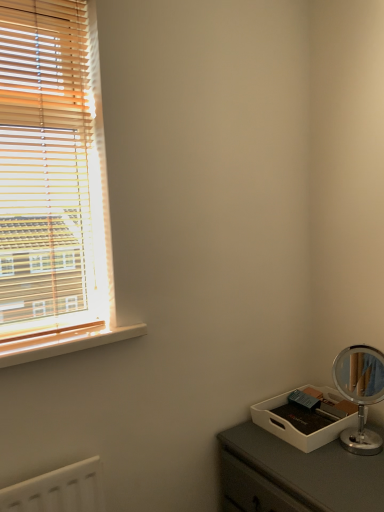
Question: From a real-world perspective, is wooden blinds at left physically below wooden at left?

Choices:
 (A) no
 (B) yes

Answer: (A)

Question: Considering the relative sizes of wooden blinds at left and wooden at left in the image provided, is wooden blinds at left smaller than wooden at left?

Choices:
 (A) yes
 (B) no

Answer: (B)

Question: Considering the relative positions of wooden blinds at left and wooden at left in the image provided, is wooden blinds at left behind wooden at left?

Choices:
 (A) yes
 (B) no

Answer: (B)

Question: Does wooden blinds at left have a greater width compared to wooden at left?

Choices:
 (A) yes
 (B) no

Answer: (B)

Question: Is wooden blinds at left oriented away from wooden at left?

Choices:
 (A) yes
 (B) no

Answer: (B)

Question: Is wooden blinds at left to the left of wooden at left from the viewer's perspective?

Choices:
 (A) no
 (B) yes

Answer: (B)

Question: Is wooden at left to the right of wooden blinds at left from the viewer's perspective?

Choices:
 (A) no
 (B) yes

Answer: (B)

Question: From the image's perspective, is wooden at left over wooden blinds at left?

Choices:
 (A) yes
 (B) no

Answer: (B)

Question: From a real-world perspective, is wooden at left positioned over wooden blinds at left based on gravity?

Choices:
 (A) yes
 (B) no

Answer: (B)

Question: Is wooden at left wider than wooden blinds at left?

Choices:
 (A) no
 (B) yes

Answer: (B)

Question: Is wooden at left oriented towards wooden blinds at left?

Choices:
 (A) no
 (B) yes

Answer: (B)

Question: Is wooden blinds at left at the back of wooden at left?

Choices:
 (A) no
 (B) yes

Answer: (B)

Question: In terms of width, does wooden at left look wider or thinner when compared to wooden blinds at left?

Choices:
 (A) thin
 (B) wide

Answer: (B)